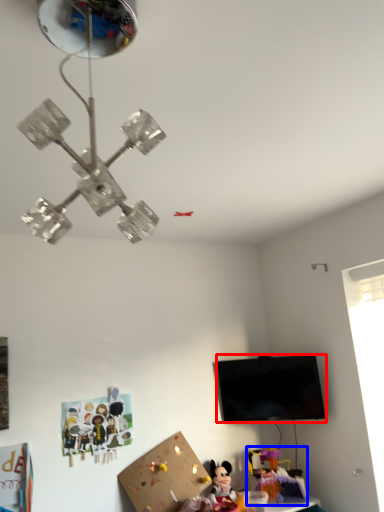
Question: Which object is further to the camera taking this photo, television (highlighted by a red box) or toy (highlighted by a blue box)?

Choices:
 (A) television
 (B) toy

Answer: (B)